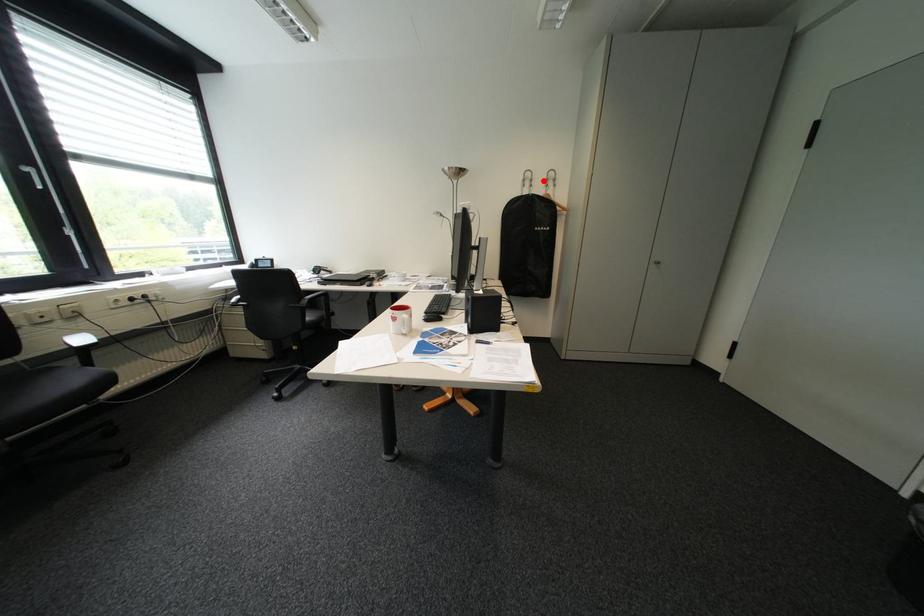
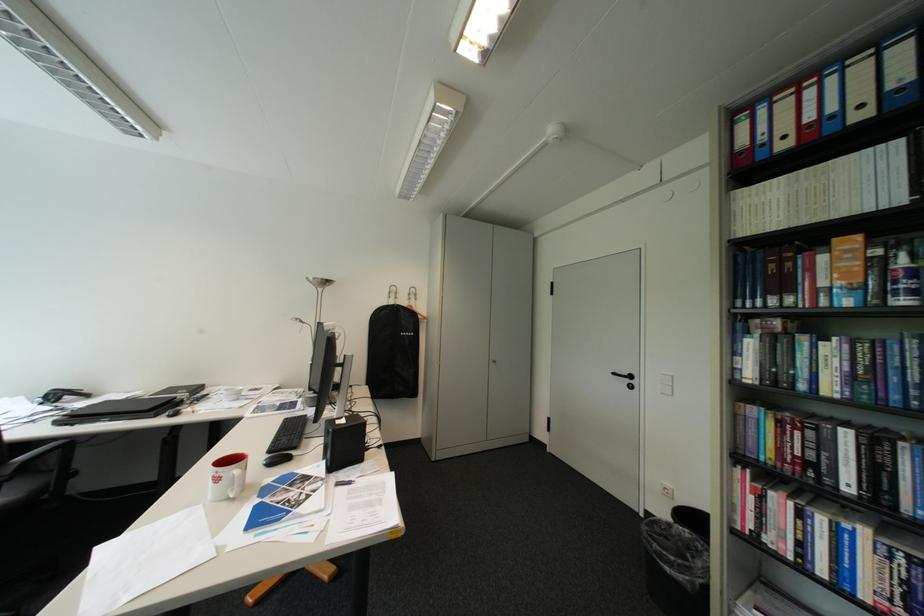
Question: A red point is marked in image1. In image2, is the corresponding 3D point closer to the camera or farther? Reply with the corresponding letter.

Choices:
 (A) The corresponding 3D point is closer.
 (B) The corresponding 3D point is farther.

Answer: (B)